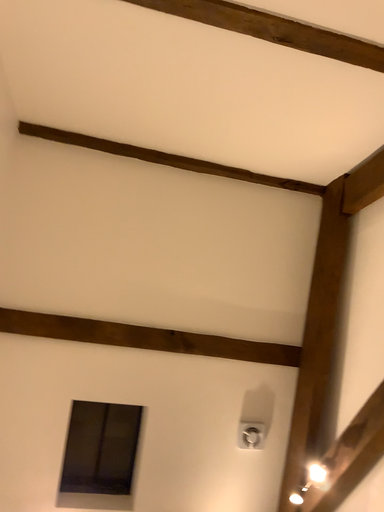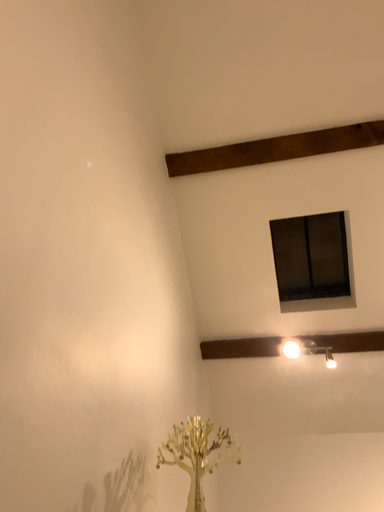
Question: Which way did the camera rotate in the video?

Choices:
 (A) rotated right
 (B) rotated left

Answer: (B)